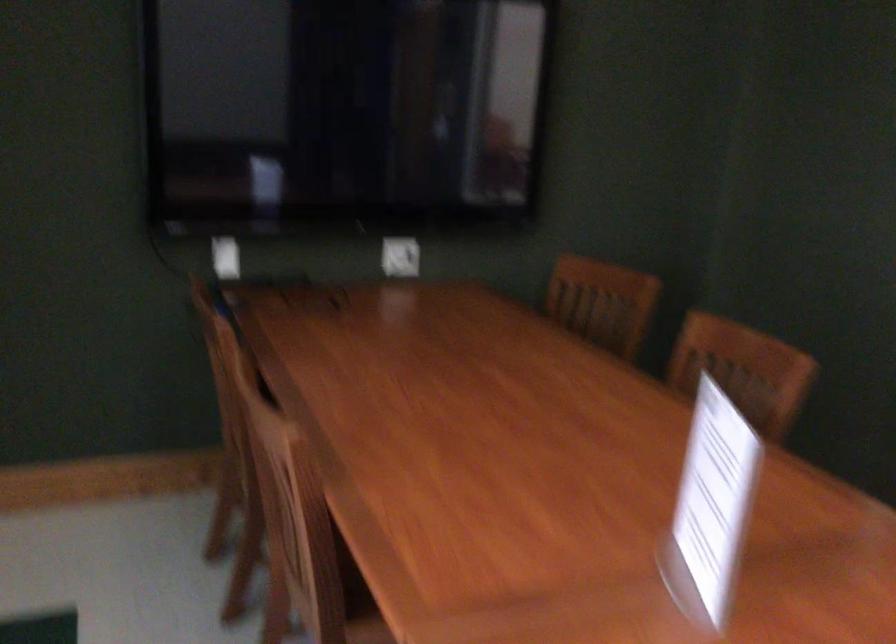
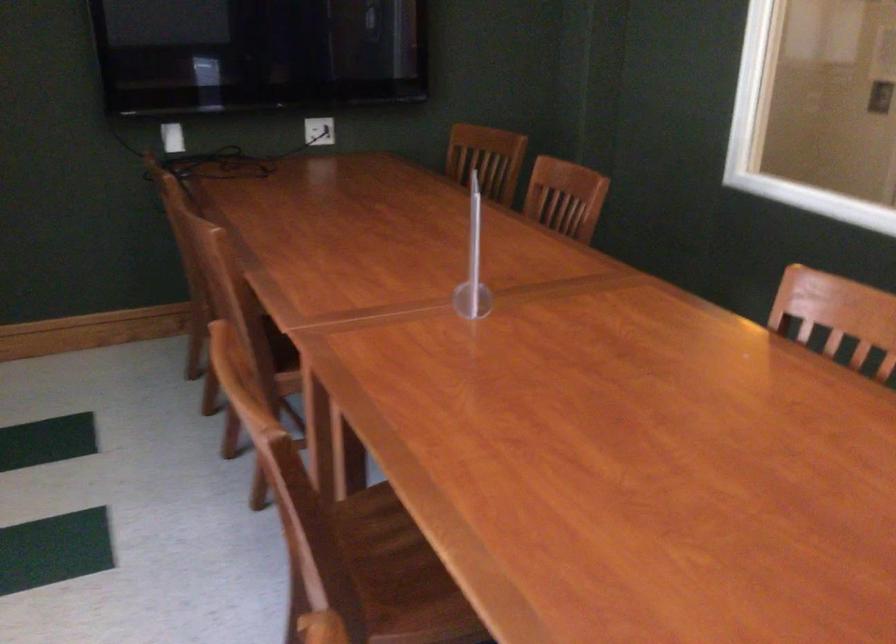
What movement of the cameraman would produce the second image?

The movement direction of the cameraman is right, backward.